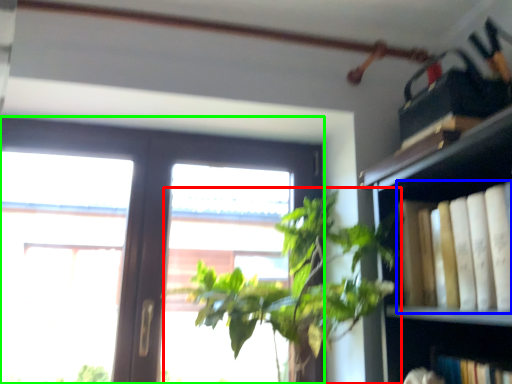
Question: Which is farther away from houseplant (highlighted by a red box)? book (highlighted by a blue box) or window (highlighted by a green box)?

Choices:
 (A) book
 (B) window

Answer: (B)